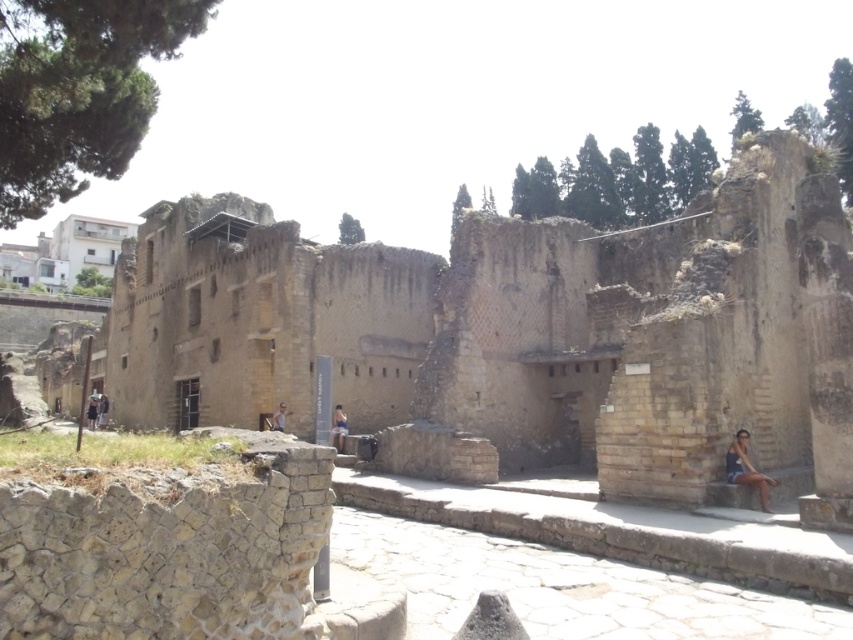
You are a photographer planning to take a photo of the ancient stone structure. You want to include both the matte blue tank top at lower right and the dark brown leather jacket at center in your frame. Which clothing item will appear smaller in the final photo?

The matte blue tank top at lower right will appear smaller in the final photo because it has a smaller size compared to the dark brown leather jacket at center.

You are standing at the entrance of the ancient stone structure and see a blue denim shorts at center. If you walk straight ahead, will you step onto the paved area made of irregularly shaped stones before reaching the point marked at coordinate (x=338, y=428)?

The point marked at coordinate (x=338, y=428) is located on the blue denim shorts at center, which is further ahead than the paved area made of irregularly shaped stones in the foreground. Therefore, you would step onto the paved area before reaching the point on the blue denim shorts.